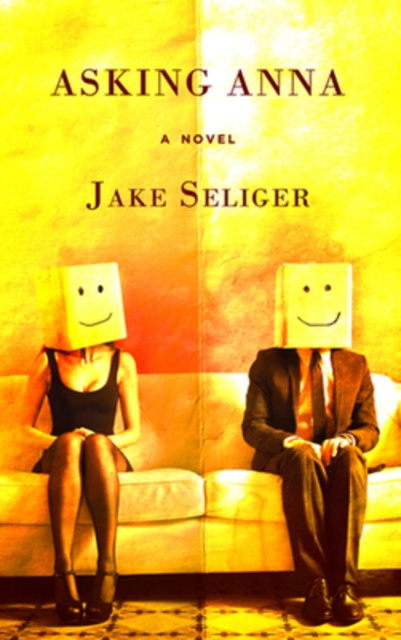
You are a fashion designer observing the cover of the book. You notice the matte brown suit at center and the matte black dress at left. Which clothing item appears taller in the image?

The matte brown suit at center appears taller than the matte black dress at left.

You are an interior designer looking at the book cover and notice the matte black dress at left and the yellow matte square at center. Which object is positioned nearer to you?

The matte black dress at left is closer to the viewer than the yellow matte square at center.

Consider the image. You are an interior designer looking at the book cover and notice the matte black dress at left and the yellow matte square at center. Which object is closer to the viewer?

The yellow matte square at center is closer to the viewer because it is positioned above the matte black dress at left, which is placed underneath it.